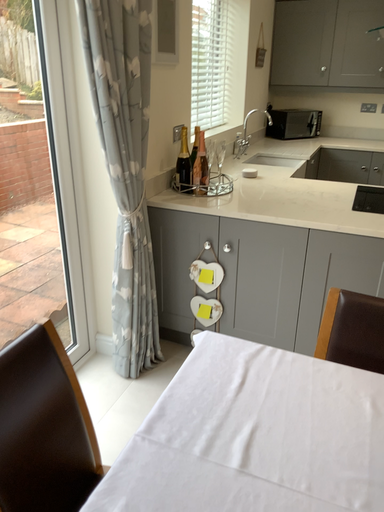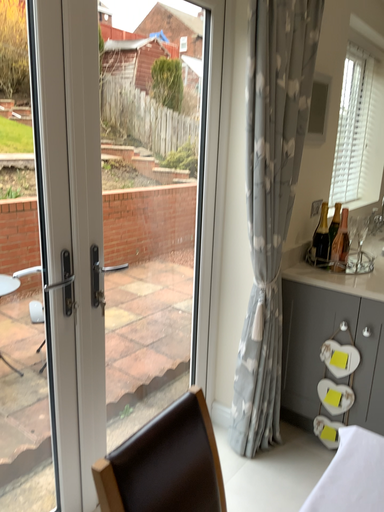
Question: Which way did the camera rotate in the video?

Choices:
 (A) rotated right
 (B) rotated left

Answer: (B)